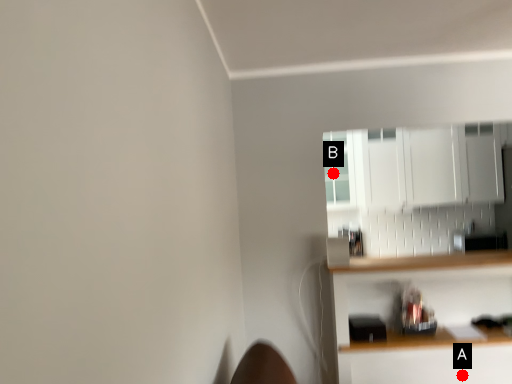
Question: Two points are circled on the image, labeled by A and B beside each circle. Which point is further to the camera?

Choices:
 (A) A is further
 (B) B is further

Answer: (B)